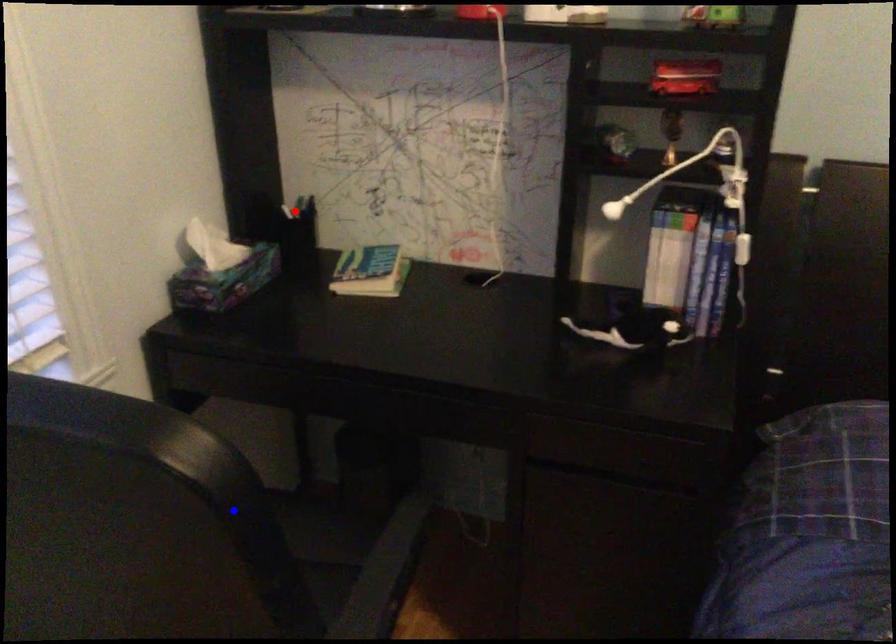
Question: Two points are marked on the image. Which point is closer to the camera?

Choices:
 (A) Blue point is closer.
 (B) Red point is closer.

Answer: (A)